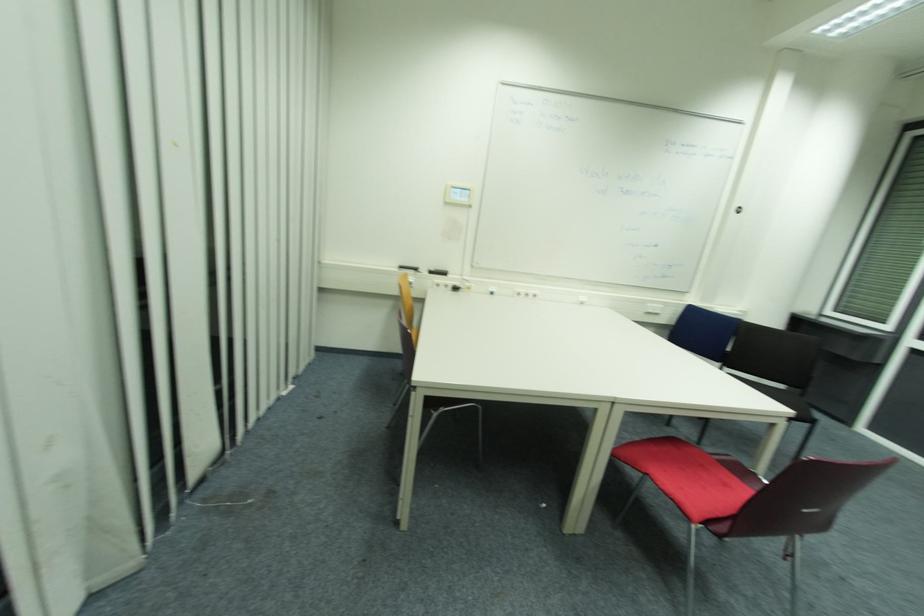
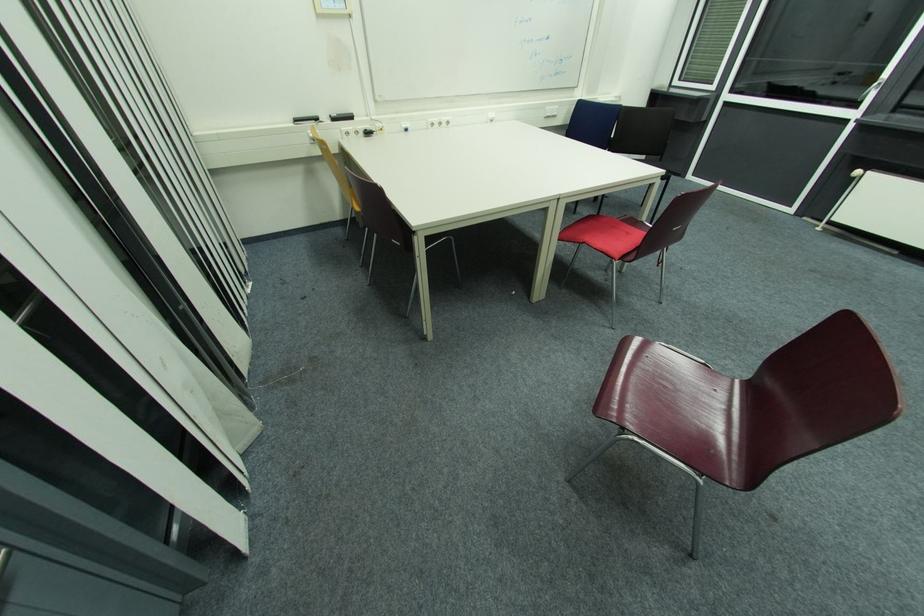
The point at (x=728, y=487) is marked in the first image. Where is the corresponding point in the second image?

(631, 235)